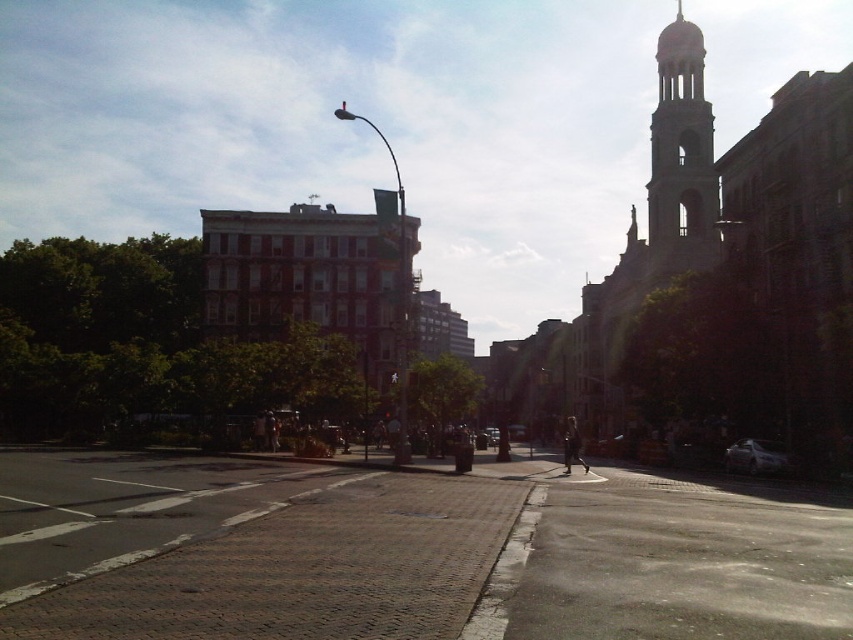
You are a delivery driver who needs to park your 1.8 meters wide van between the satin silver sedan at lower right and the metallic silver car at center. Can you fit your van there based on their widths?

The satin silver sedan at lower right is narrower than the metallic silver car at center, but the exact width difference isn not specified. However, since the sedan is narrower, there might be enough space between them for your van. However, without knowing the exact distance between the two vehicles, it is impossible to determine if the 1.8 meters wide van can fit.

You are a photographer trying to capture both the gray stone tower at upper right and the satin silver sedan at lower right in a single frame. Given their sizes, which object should you focus on first to ensure both are visible in the composition?

The gray stone tower at upper right is larger than the satin silver sedan at lower right, so you should focus on the gray stone tower at upper right first to ensure it fits within the frame while still allowing space for the smaller sedan.

You are a delivery drone operator. Your drone needs to fly from the metallic silver car at center to the gray stone tower at upper right. The drone has a maximum flight range of 30 meters. Can it make the trip without recharging?

The gray stone tower at upper right is 31.04 meters from the metallic silver car at center, so the drone cannot make the trip without recharging since it exceeds the maximum range of 30 meters.